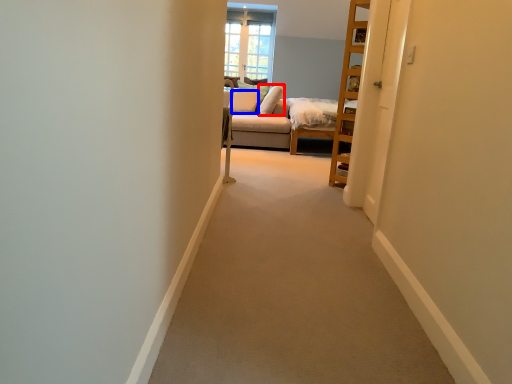
Question: Which of the following is the farthest to the observer, pillow (highlighted by a red box) or pillow (highlighted by a blue box)?

Choices:
 (A) pillow
 (B) pillow

Answer: (B)